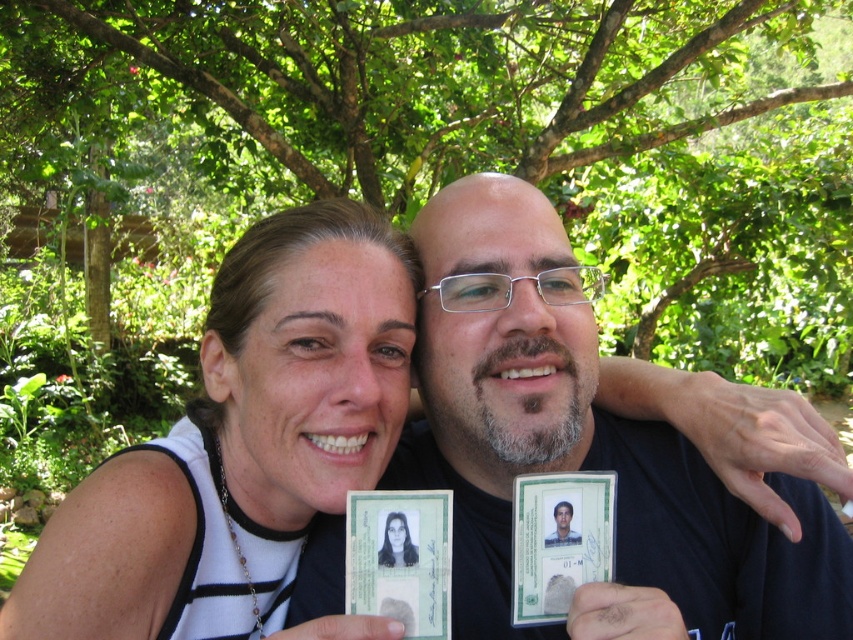
Question: From the image, what is the correct spatial relationship of green leafy tree at upper center in relation to white matte id card at center?

Choices:
 (A) left
 (B) right

Answer: (B)

Question: Can you confirm if smooth black id card at center is positioned to the right of green plastic id card at center?

Choices:
 (A) yes
 (B) no

Answer: (B)

Question: Which is farther from the green plastic id card at center?

Choices:
 (A) black matte id card at center
 (B) white matte id card at center
 (C) smooth black id card at center
 (D) green leafy tree at upper center

Answer: (D)

Question: Does green leafy tree at upper center have a lesser width compared to white matte id card at center?

Choices:
 (A) no
 (B) yes

Answer: (A)

Question: Among these objects, which one is nearest to the camera?

Choices:
 (A) white matte id card at center
 (B) black matte id card at center
 (C) green plastic id card at center
 (D) green leafy tree at upper center

Answer: (A)

Question: Which of the following is the closest to the observer?

Choices:
 (A) white matte id card at center
 (B) smooth black id card at center
 (C) green leafy tree at upper center

Answer: (A)